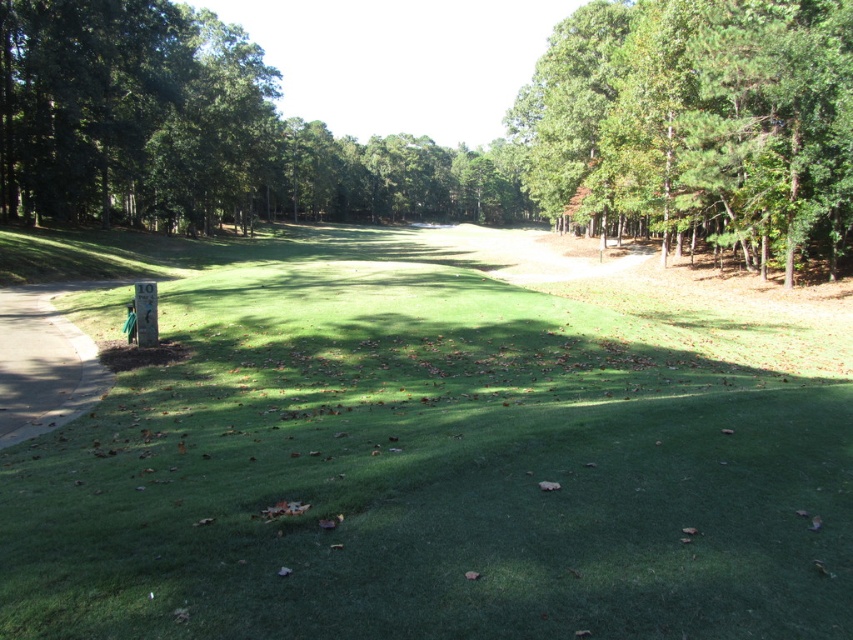
You are a golfer standing on the green turf at center. You want to hit a ball to the concrete at left. Is the ball going to roll towards you or away from you?

The green turf at center is much taller than the concrete at left, so the ball will roll away from you towards the lower elevation of the concrete at left.

You are a golfer standing on the green turf at center. You want to hit your ball towards the green leafy trees at upper right. Which direction should you aim relative to your current position?

You should aim to the right because the green turf at center is to the left of the green leafy trees at upper right, so moving towards the right direction will lead you towards the trees.

You are a golfer standing on the fairway and want to hit the ball towards the green. You notice the green leafy trees at upper right and the concrete at left. Which object is bigger in the image?

The green leafy trees at upper right is bigger compared to the concrete at left.